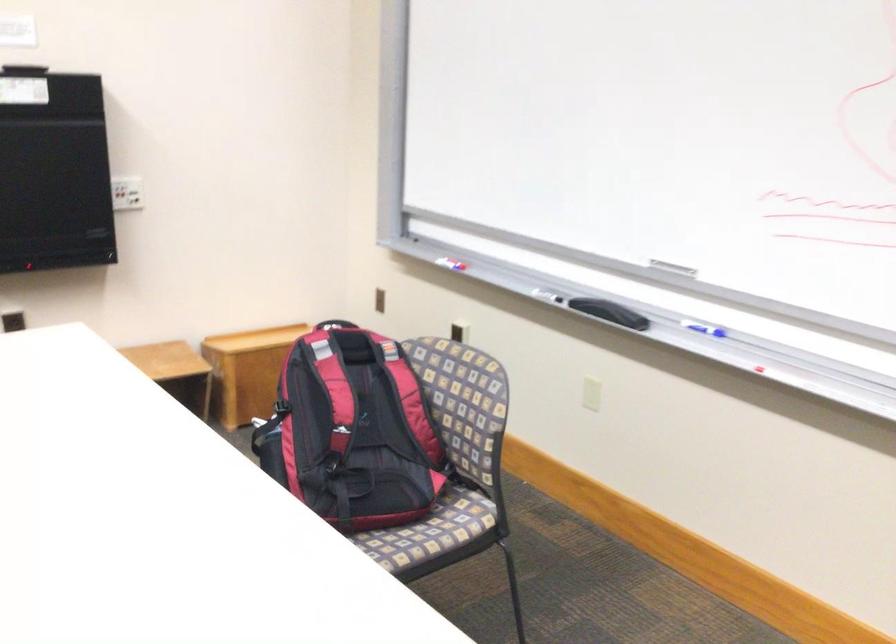
What are the coordinates of `chair sitting surface` in the screenshot? It's located at (427, 534).